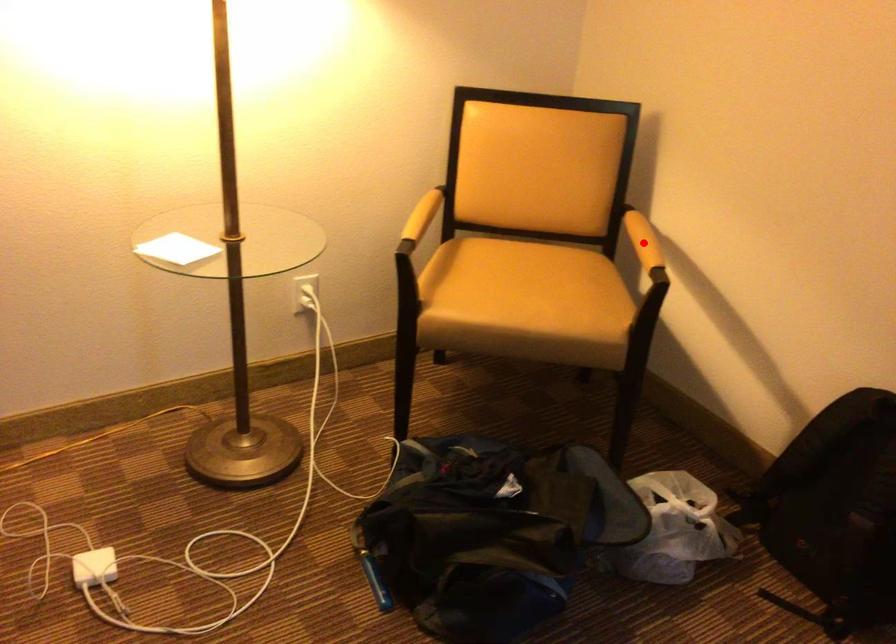
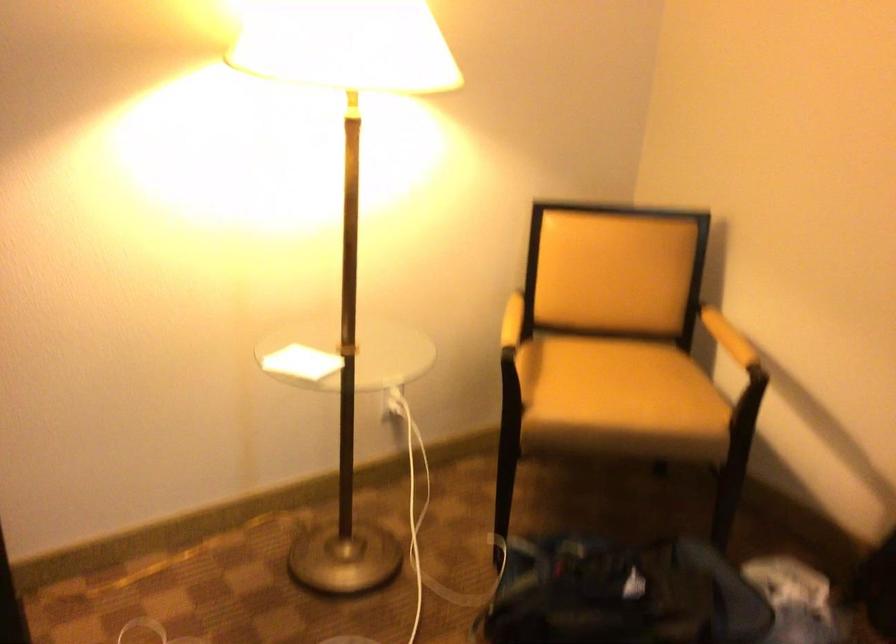
Locate, in the second image, the point that corresponds to the highlighted location in the first image.

(728, 337)